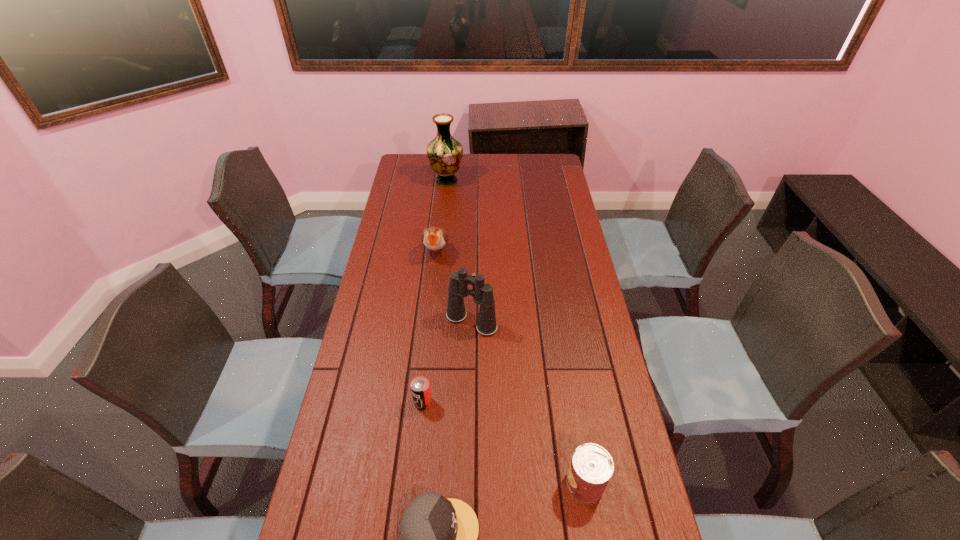
Find the location of a particular element. free point located on the right of the vase is located at coordinates (536, 181).

In order to click on blank space located 0.240m on the left of the fourth nearest object in this screenshot , I will do `click(374, 322)`.

Image resolution: width=960 pixels, height=540 pixels. In order to click on blank area located 0.070m at the face of the second farthest object in this screenshot , I will do `click(433, 280)`.

Identify the location of free space located on the back of the nearer can. (564, 355).

Find the location of `vacant region located 0.150m on the back of the shorter can`. vacant region located 0.150m on the back of the shorter can is located at coordinates (428, 352).

Image resolution: width=960 pixels, height=540 pixels. In order to click on object that is at the far edge in this screenshot , I will do `click(444, 152)`.

What are the coordinates of `object positioned at the left edge` in the screenshot? It's located at pyautogui.click(x=444, y=152).

In order to click on object present at the right edge in this screenshot , I will do `click(591, 467)`.

This screenshot has height=540, width=960. In order to click on object positioned at the far left corner in this screenshot , I will do `click(444, 152)`.

The height and width of the screenshot is (540, 960). In the image, there is a desktop. In order to click on free space at the far edge in this screenshot , I will do `click(474, 159)`.